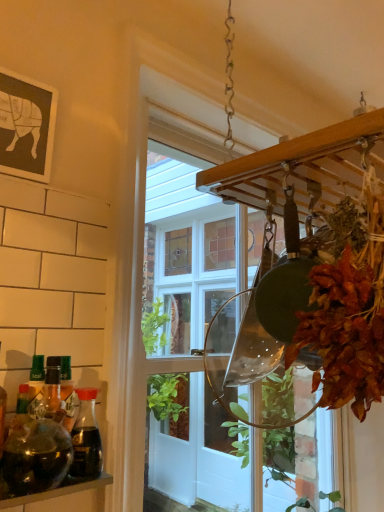
Question: Is clear glass window at center completely or partially inside translucent glass bottle at left, the second bottle viewed from the front?

Choices:
 (A) no
 (B) yes

Answer: (A)

Question: Is the depth of translucent glass bottle at left, which is the 1th bottle from back to front, less than that of clear glass window at center?

Choices:
 (A) yes
 (B) no

Answer: (A)

Question: Can you confirm if translucent glass bottle at left, which is the 1th bottle from back to front, is smaller than clear glass window at center?

Choices:
 (A) no
 (B) yes

Answer: (B)

Question: From a real-world perspective, is translucent glass bottle at left, which is the 1th bottle from back to front, beneath clear glass window at center?

Choices:
 (A) no
 (B) yes

Answer: (B)

Question: Are translucent glass bottle at left, which is the 1th bottle from back to front, and clear glass window at center located far from each other?

Choices:
 (A) yes
 (B) no

Answer: (A)

Question: From the image's perspective, is translucent glass bottle at left, the second bottle viewed from the front, on clear glass window at center?

Choices:
 (A) no
 (B) yes

Answer: (A)

Question: From a real-world perspective, is clear glass window at center positioned over translucent glass bottle at left, which is the 1th bottle from back to front, based on gravity?

Choices:
 (A) no
 (B) yes

Answer: (B)

Question: From a real-world perspective, is clear glass window at center beneath translucent glass bottle at left, which is the 1th bottle from back to front?

Choices:
 (A) no
 (B) yes

Answer: (A)

Question: Can you confirm if clear glass window at center is wider than translucent glass bottle at left, which is the 1th bottle from back to front?

Choices:
 (A) yes
 (B) no

Answer: (A)

Question: Is clear glass window at center positioned before translucent glass bottle at left, which is the 1th bottle from back to front?

Choices:
 (A) no
 (B) yes

Answer: (A)

Question: Is clear glass window at center far away from translucent glass bottle at left, the second bottle viewed from the front?

Choices:
 (A) yes
 (B) no

Answer: (A)

Question: From the image's perspective, does clear glass window at center appear lower than translucent glass bottle at left, the second bottle viewed from the front?

Choices:
 (A) yes
 (B) no

Answer: (B)

Question: Is translucent glass bottle at left, the second bottle viewed from the front, oriented away from transparent glass jar at lower left?

Choices:
 (A) no
 (B) yes

Answer: (A)